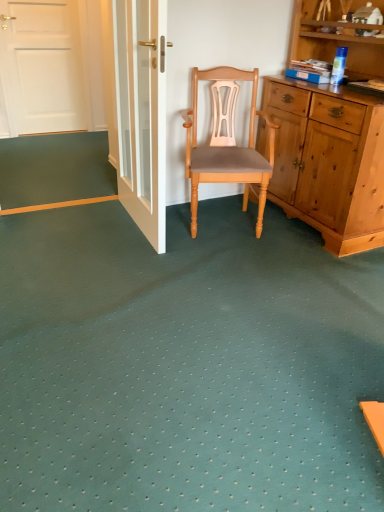
Describe the element at coordinates (142, 112) in the screenshot. The height and width of the screenshot is (512, 384). I see `white glossy door at upper center` at that location.

Locate an element on the screen. white glossy door at upper center is located at coordinates (142, 112).

Between white glossy door at upper center and orange matte strip at lower left, which one has less height?

With less height is orange matte strip at lower left.

Is white glossy door at upper center at the right side of orange matte strip at lower left?

Indeed, white glossy door at upper center is positioned on the right side of orange matte strip at lower left.

Is white glossy door at upper center wider or thinner than orange matte strip at lower left?

In the image, white glossy door at upper center appears to be more narrow than orange matte strip at lower left.

From a real-world perspective, is light brown wood chair at center below orange matte strip at lower left?

No.

Which is farther from the camera, (201, 161) or (77, 204)?

The point (77, 204) is farther.

Is the depth of light brown wood chair at center greater than that of orange matte strip at lower left?

No, the depth of light brown wood chair at center is less than that of orange matte strip at lower left.

Are light brown wood chair at center and orange matte strip at lower left located far from each other?

No, there isn't a large distance between light brown wood chair at center and orange matte strip at lower left.

Is point (117, 195) closer to camera compared to point (245, 192)?

No, it is not.

In the scene shown: Would you say orange matte strip at lower left is to the left or to the right of light brown wood chair at center in the picture?

From the image, it's evident that orange matte strip at lower left is to the left of light brown wood chair at center.

How different are the orientations of orange matte strip at lower left and light brown wood chair at center in degrees?

The facing directions of orange matte strip at lower left and light brown wood chair at center are 67.8 degrees apart.

Measure the distance from orange matte strip at lower left to light brown wood chair at center.

orange matte strip at lower left and light brown wood chair at center are 38.64 inches apart from each other.

How much distance is there between orange matte strip at lower left and white glossy door at upper center?

77.86 centimeters.

From the image's perspective, which one is positioned higher, orange matte strip at lower left or white glossy door at upper center?

white glossy door at upper center.

Based on their positions, is orange matte strip at lower left located to the left or right of white glossy door at upper center?

Based on their positions, orange matte strip at lower left is located to the left of white glossy door at upper center.

Is white glossy door at upper center positioned beyond the bounds of light brown wood chair at center?

Indeed, white glossy door at upper center is completely outside light brown wood chair at center.

Considering their positions, is white glossy door at upper center located in front of or behind light brown wood chair at center?

In the image, white glossy door at upper center appears in front of light brown wood chair at center.

Can you tell me how much white glossy door at upper center and light brown wood chair at center differ in facing direction?

There is a 70.1-degree angle between the facing directions of white glossy door at upper center and light brown wood chair at center.

In the scene shown: Can you see light brown wood chair at center touching white glossy door at upper center?

There is a gap between light brown wood chair at center and white glossy door at upper center.

Does point (192, 206) appear closer or farther from the camera than point (160, 16)?

Point (192, 206) appears to be farther away from the viewer than point (160, 16).

Is white glossy door at upper center completely or partially inside light brown wood chair at center?

No, white glossy door at upper center is not a part of light brown wood chair at center.

From the image's perspective, which object appears higher, light brown wood chair at center or white glossy door at upper center?

white glossy door at upper center appears higher in the image.

This screenshot has width=384, height=512. In the image, there is a white glossy door at upper center. Identify the location of strip below it (from the image's perspective). (57, 205).

I want to click on chair above the orange matte strip at lower left (from a real-world perspective), so click(x=228, y=143).

Which object lies nearer to the anchor point white glossy door at upper center, orange matte strip at lower left or light brown wood chair at center?

Based on the image, light brown wood chair at center appears to be nearer to white glossy door at upper center.

Looking at the image, which one is located closer to light brown wood chair at center, white glossy door at upper center or orange matte strip at lower left?

The object closer to light brown wood chair at center is white glossy door at upper center.

Which object lies nearer to the anchor point light brown wood chair at center, orange matte strip at lower left or white glossy door at upper center?

Based on the image, white glossy door at upper center appears to be nearer to light brown wood chair at center.

When comparing their distances from orange matte strip at lower left, does white glossy door at upper center or light brown wood chair at center seem closer?

The object closer to orange matte strip at lower left is white glossy door at upper center.

In the scene shown: When comparing their distances from white glossy door at upper center, does light brown wood chair at center or orange matte strip at lower left seem further?

orange matte strip at lower left is further to white glossy door at upper center.

From the image, which object appears to be farther from orange matte strip at lower left, light brown wood chair at center or white glossy door at upper center?

The object further to orange matte strip at lower left is light brown wood chair at center.

At what (x,y) coordinates should I click in order to perform the action: click on door between orange matte strip at lower left and light brown wood chair at center. Please return your answer as a coordinate pair (x, y). The image size is (384, 512). Looking at the image, I should click on [x=142, y=112].